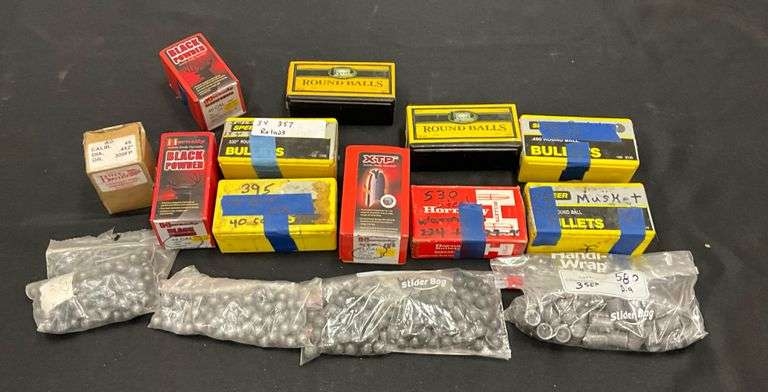
Locate an element on the screen. Image resolution: width=768 pixels, height=392 pixels. covering table black is located at coordinates (53, 149).